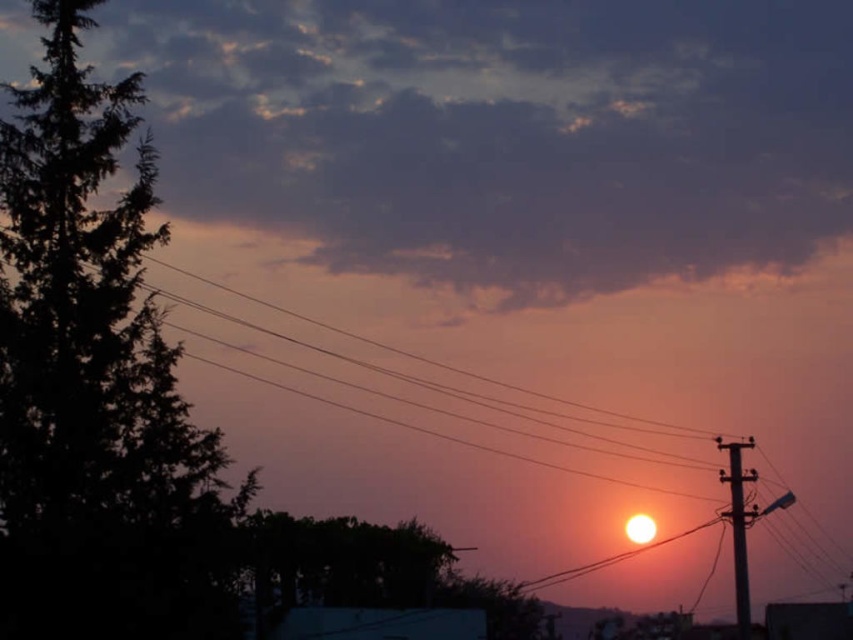
Question: Is dark green leafy tree at left below metallic gray telegraph pole at right?

Choices:
 (A) yes
 (B) no

Answer: (B)

Question: Estimate the real-world distances between objects in this image. Which object is farther from the metallic gray telegraph pole at right?

Choices:
 (A) metallic wires at right
 (B) dark green leafy tree at left

Answer: (A)

Question: Does dark green leafy tree at left come in front of metallic gray telegraph pole at right?

Choices:
 (A) yes
 (B) no

Answer: (A)

Question: Considering the relative positions of metallic wires at right and metallic gray telegraph pole at right in the image provided, where is metallic wires at right located with respect to metallic gray telegraph pole at right?

Choices:
 (A) above
 (B) below

Answer: (A)

Question: Considering the real-world distances, which object is farthest from the dark green leafy tree at left?

Choices:
 (A) metallic gray telegraph pole at right
 (B) metallic wires at right

Answer: (B)

Question: Among these points, which one is farthest from the camera?

Choices:
 (A) (160, 608)
 (B) (759, 323)

Answer: (B)